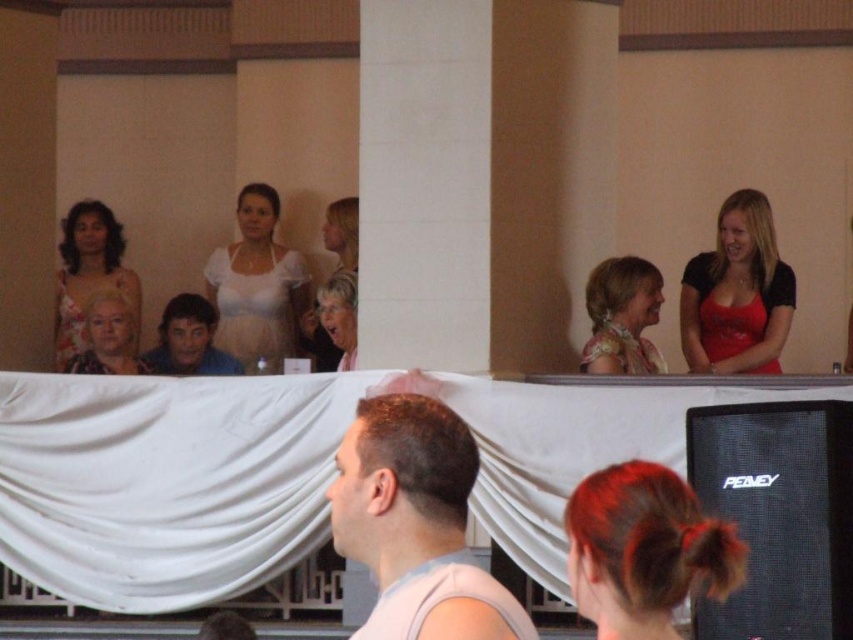
Question: Which object is positioned farthest from the matte white dress at center?

Choices:
 (A) red satin dress at upper right
 (B) dark brown hair bun at lower center
 (C) floral-patterned blouse at upper center
 (D) matte gold necklace at center

Answer: (B)

Question: Among these points, which one is farthest from the camera?

Choices:
 (A) (265, 248)
 (B) (88, 275)

Answer: (A)

Question: Can you confirm if black matte speaker at upper right is positioned above shiny blue shirt at center?

Choices:
 (A) yes
 (B) no

Answer: (B)

Question: Based on their relative distances, which object is farther from the matte floral dress at upper left?

Choices:
 (A) floral-patterned blouse at upper center
 (B) black matte speaker at upper right

Answer: (B)

Question: Is white satin dress at center closer to camera compared to matte white dress at center?

Choices:
 (A) no
 (B) yes

Answer: (B)

Question: Is matte floral dress at upper left wider than floral-patterned blouse at upper center?

Choices:
 (A) no
 (B) yes

Answer: (B)